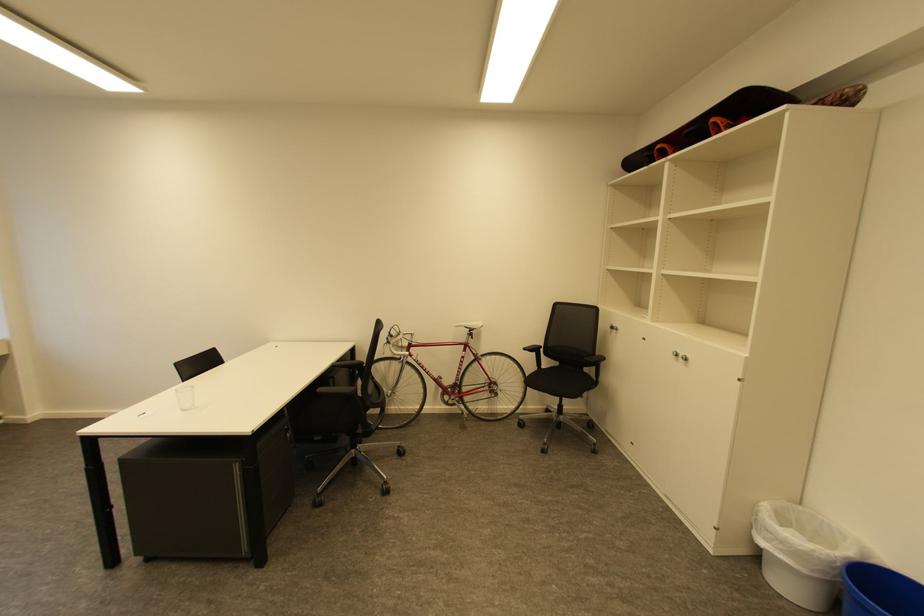
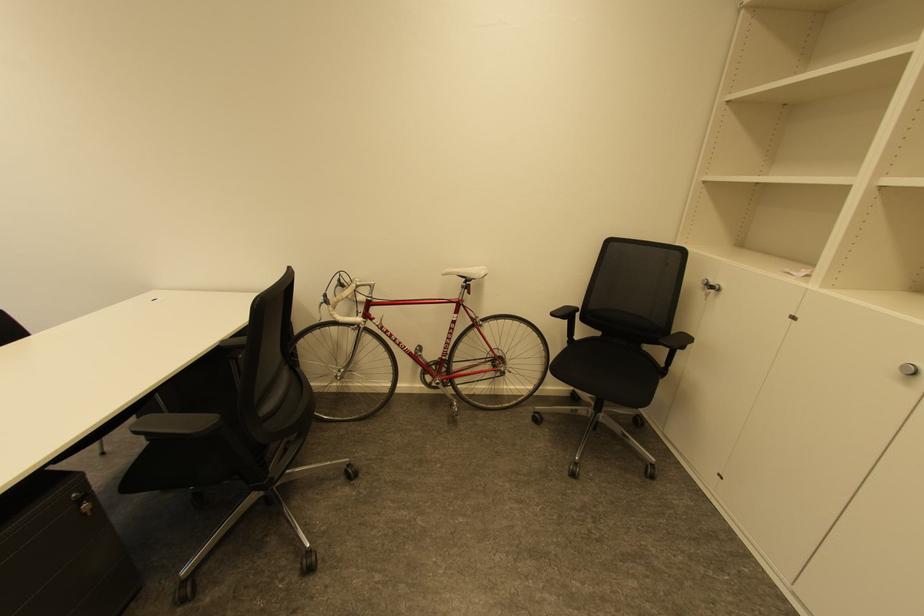
Question: What movement of the cameraman would produce the second image?

Choices:
 (A) Left
 (B) Right
 (C) Forward
 (D) Backward

Answer: (C)